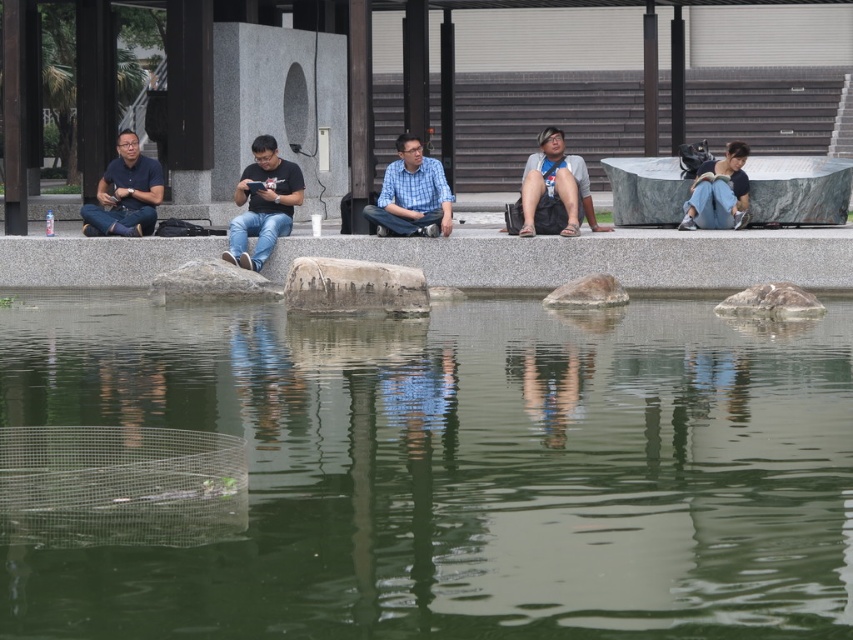
Question: Which of the following is the farthest from the observer?

Choices:
 (A) rough textured rock at center right
 (B) gray rough stone at center
 (C) gray stone at center

Answer: (B)

Question: Is rough gray stone at center below gray rough stone at center?

Choices:
 (A) no
 (B) yes

Answer: (B)

Question: Can you confirm if green translucent water at center is positioned below gray granite ledge at center?

Choices:
 (A) no
 (B) yes

Answer: (B)

Question: Does blue checkered shirt at center appear under matte black shirt at left?

Choices:
 (A) no
 (B) yes

Answer: (A)

Question: Estimate the real-world distances between objects in this image. Which object is farther from the denim jeans at right?

Choices:
 (A) blue checkered shirt at center
 (B) gray matte shorts at center

Answer: (A)

Question: Which point is farther to the camera?

Choices:
 (A) (352, 296)
 (B) (549, 208)
 (C) (415, 184)
 (D) (601, 291)

Answer: (C)